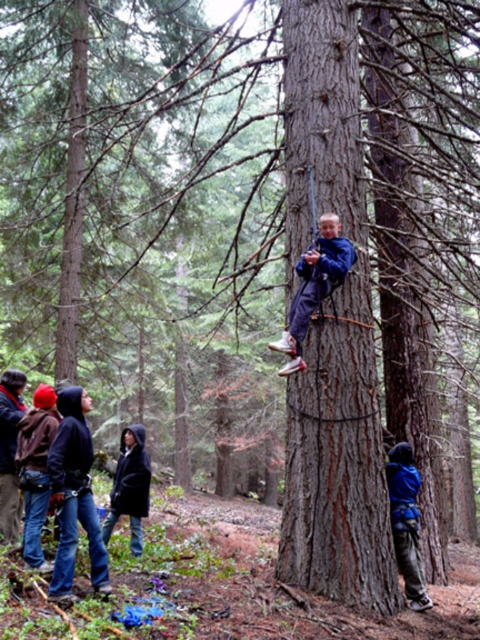
Between brown rough tree trunk at center and brushed metal jacket at lower left, which one appears on the right side from the viewer's perspective?

From the viewer's perspective, brown rough tree trunk at center appears more on the right side.

Which is behind, point (336, 72) or point (8, 492)?

The point (8, 492) is behind.

This screenshot has width=480, height=640. In order to click on brown rough tree trunk at center in this screenshot , I will do `click(332, 332)`.

Which is above, blue fleece jacket at center or brushed metal jacket at lower left?

blue fleece jacket at center

Does point (307, 312) come farther from viewer compared to point (3, 483)?

No, (307, 312) is in front of (3, 483).

Identify the location of blue fleece jacket at center. (313, 285).

Which is more to the right, brown rough tree trunk at center or dark blue hoodie at center?

brown rough tree trunk at center

Between point (349, 525) and point (124, 436), which one is positioned in front?

Positioned in front is point (349, 525).

This screenshot has width=480, height=640. Find the location of `brown rough tree trunk at center`. brown rough tree trunk at center is located at coordinates (332, 332).